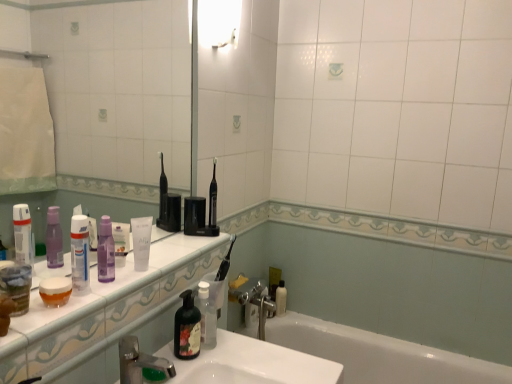
The image size is (512, 384). Identify the location of vacant area in front of purple matte bottle at center. (73, 305).